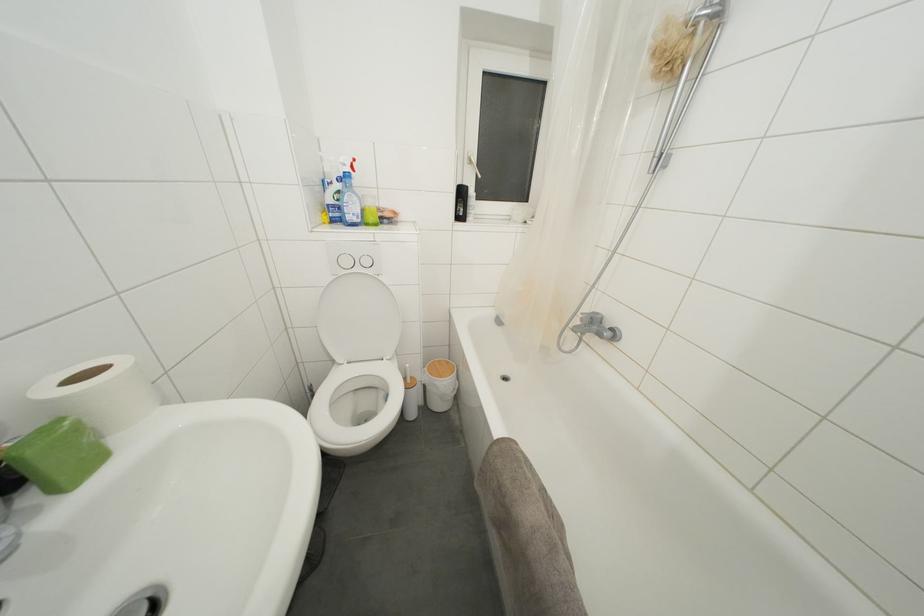
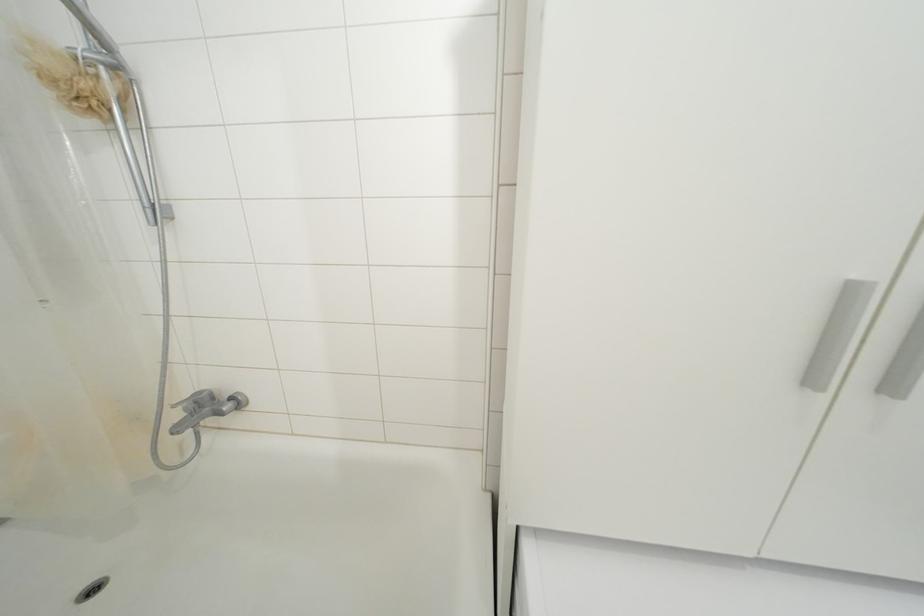
Question: How did the camera likely rotate?

Choices:
 (A) Left
 (B) Right
 (C) Up
 (D) Down

Answer: (B)